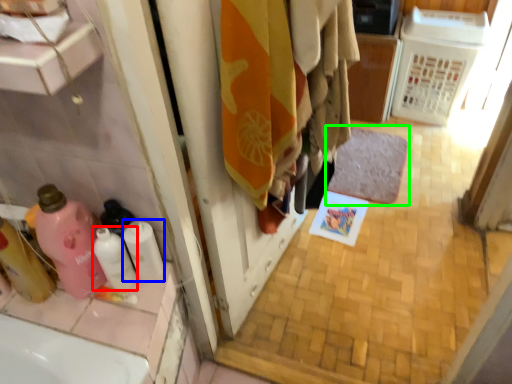
Question: Based on their relative distances, which object is farther from cleaning product (highlighted by a red box)? Choose from toilet paper (highlighted by a blue box) and bath mat (highlighted by a green box).

Choices:
 (A) toilet paper
 (B) bath mat

Answer: (B)